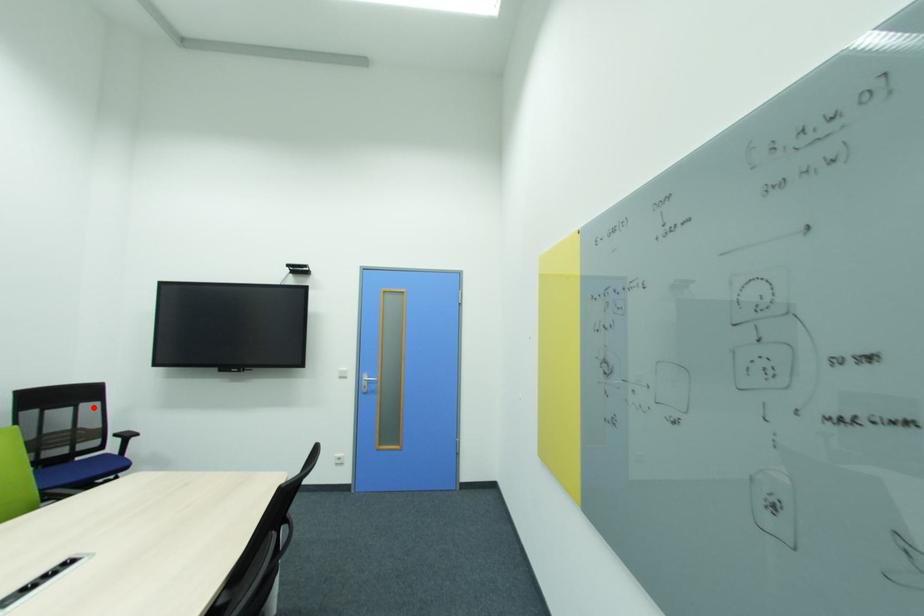
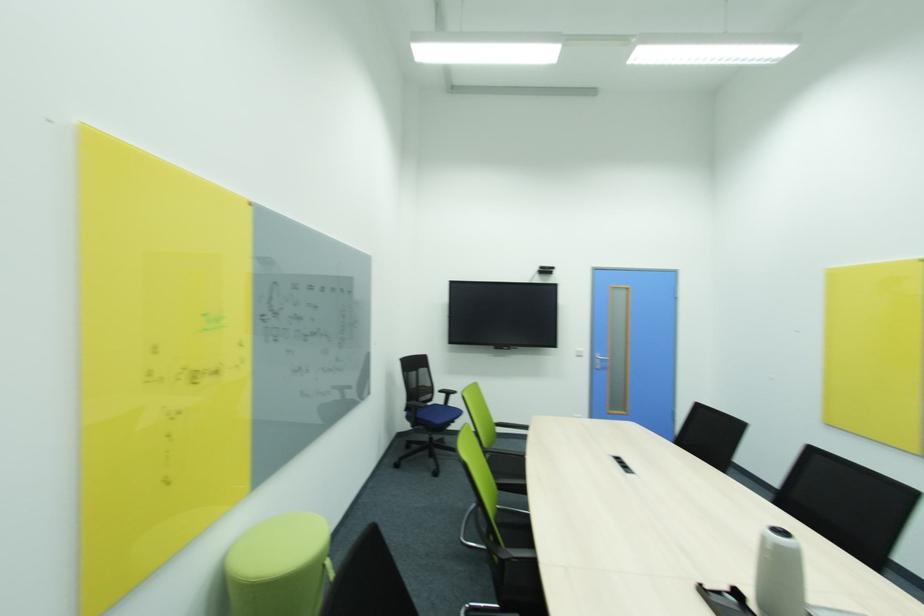
Locate, in the second image, the point that corresponds to the highlighted location in the first image.

(428, 371)